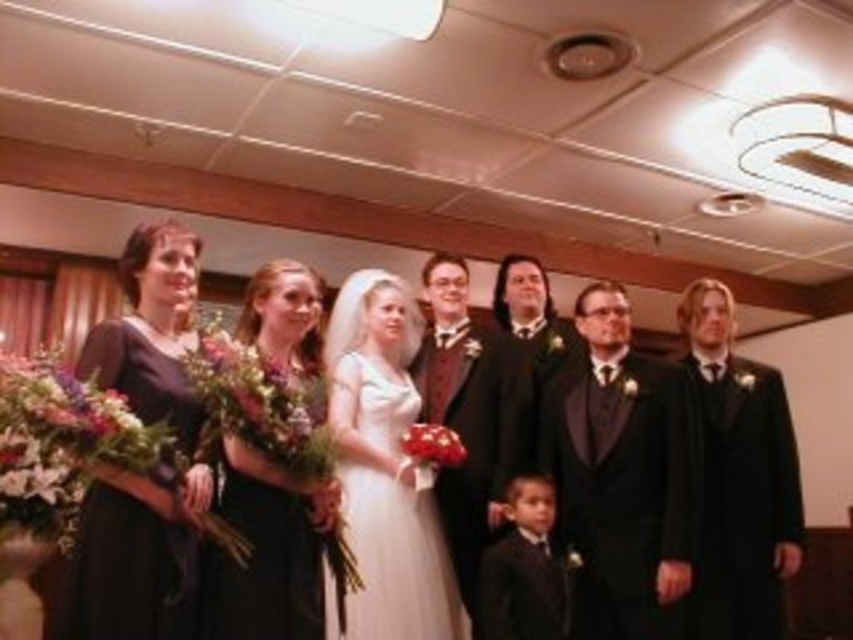
Question: Considering the relative positions of white satin dress at center and matte black suit at center in the image provided, where is white satin dress at center located with respect to matte black suit at center?

Choices:
 (A) left
 (B) right

Answer: (A)

Question: Which point appears farthest from the camera in this image?

Choices:
 (A) (448, 420)
 (B) (512, 294)
 (C) (699, 376)

Answer: (B)

Question: Which is farther from the matte black dress at left?

Choices:
 (A) shiny red bow tie at center
 (B) shiny black suit at center
 (C) white satin dress at center
 (D) matte black suit at center

Answer: (B)

Question: Does shiny black suit at center have a greater width compared to shiny red bow tie at center?

Choices:
 (A) yes
 (B) no

Answer: (A)

Question: Does black satin suit at right have a lesser width compared to floral bouquet at left?

Choices:
 (A) yes
 (B) no

Answer: (B)

Question: Which object is the closest to the floral bouquet at left?

Choices:
 (A) white satin dress at center
 (B) black satin suit at right
 (C) shiny red bow tie at center
 (D) matte black dress at left

Answer: (D)